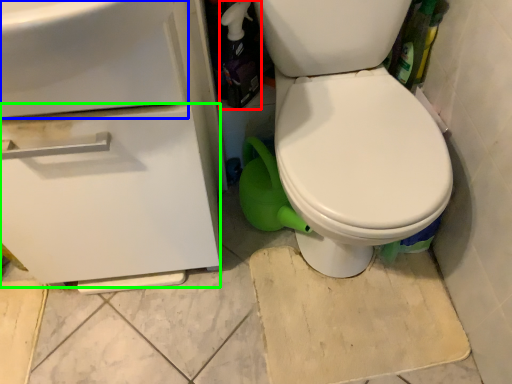
Question: Which object is positioned farthest from bottle (highlighted by a red box)? Select from sink (highlighted by a blue box) and drawer (highlighted by a green box).

Choices:
 (A) sink
 (B) drawer

Answer: (A)